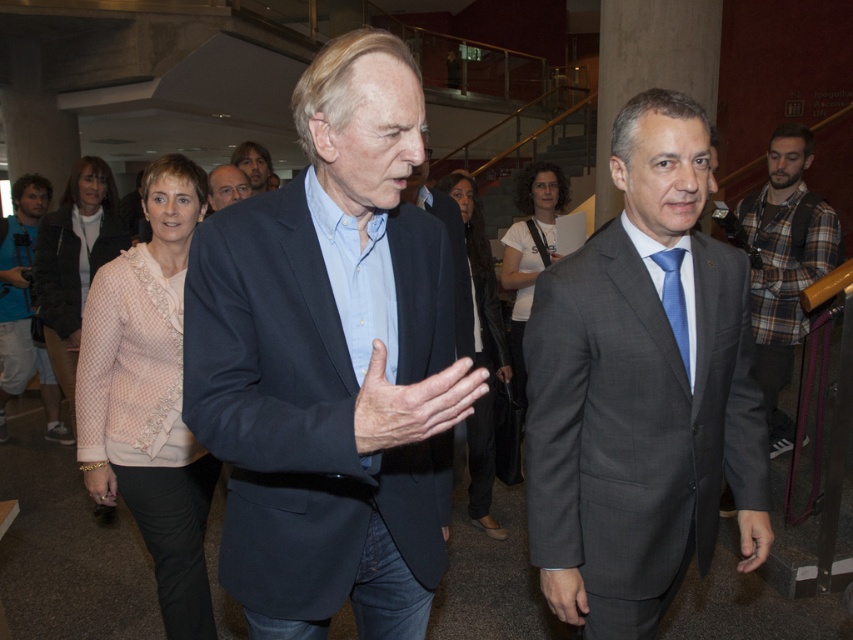
Based on the scene described, which object is bigger between the plaid flannel shirt at right and the light brown hair at center?

The plaid fladel shirt at right is larger in size than the light brown hair at center according to the description.

In the scene, there are a man in a plaid flannel shirt at right and a dry skin hand at center. Which object is taller?

The plaid flail shirt at right is taller than the dry skin hand at center.